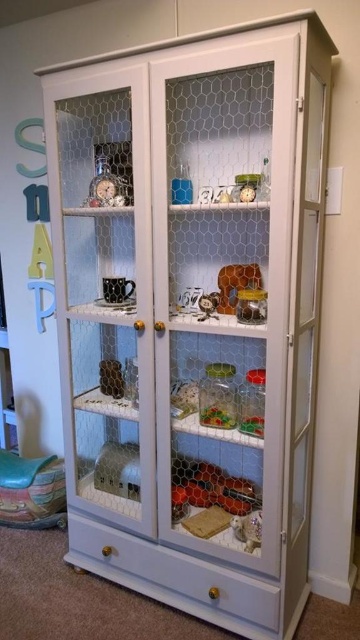
Question: Is matte black figurine at center thinner than metallic silver toy at center?

Choices:
 (A) no
 (B) yes

Answer: (A)

Question: Which point appears farthest from the camera in this image?

Choices:
 (A) (186, 289)
 (B) (243, 525)

Answer: (A)

Question: Which object appears farthest from the camera in this image?

Choices:
 (A) matte plastic toy at center
 (B) matte black figurine at center
 (C) translucent plastic bear at center

Answer: (B)

Question: Is metallic clock at upper left wider than matte white figurine at center?

Choices:
 (A) no
 (B) yes

Answer: (B)

Question: Among these objects, which one is farthest from the camera?

Choices:
 (A) matte black figurine at center
 (B) matte plastic toy at center

Answer: (A)

Question: Does matte white figurine at center lie in front of matte plastic toy at center?

Choices:
 (A) yes
 (B) no

Answer: (A)